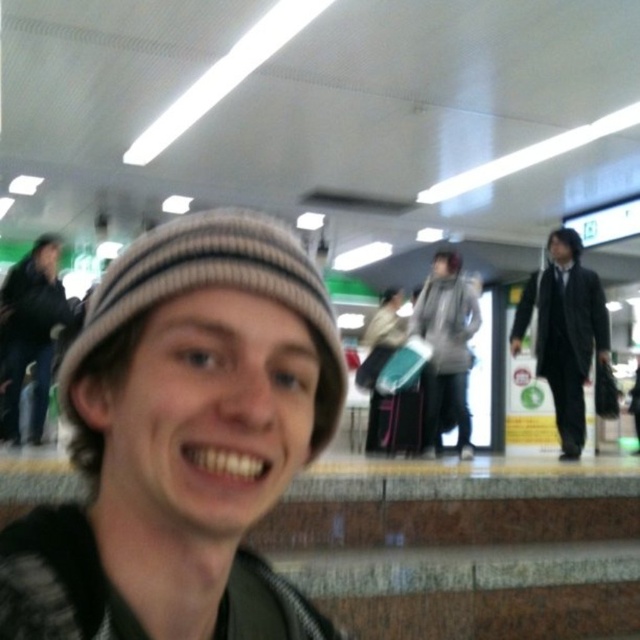
What are the coordinates of `knitted woolen hat at center` in the screenshot? It's located at (212, 285).

Does knitted woolen hat at center appear on the left side of knitted beige scarf at center?

Correct, you'll find knitted woolen hat at center to the left of knitted beige scarf at center.

Does knitted woolen hat at center appear over knitted beige scarf at center?

Yes, knitted woolen hat at center is above knitted beige scarf at center.

Image resolution: width=640 pixels, height=640 pixels. What do you see at coordinates (212, 285) in the screenshot? I see `knitted woolen hat at center` at bounding box center [212, 285].

Where is `knitted woolen hat at center`? knitted woolen hat at center is located at coordinates (212, 285).

Who is more distant from viewer, (328, 358) or (552, 282)?

Point (552, 282)

Between point (234, 220) and point (556, 419), which one is positioned in front?

Point (234, 220) is in front.

The width and height of the screenshot is (640, 640). What are the coordinates of `knit cap at center` in the screenshot? It's located at (182, 440).

At what (x,y) coordinates should I click in order to perform the action: click on knit cap at center. Please return your answer as a coordinate pair (x, y). The height and width of the screenshot is (640, 640). Looking at the image, I should click on (182, 440).